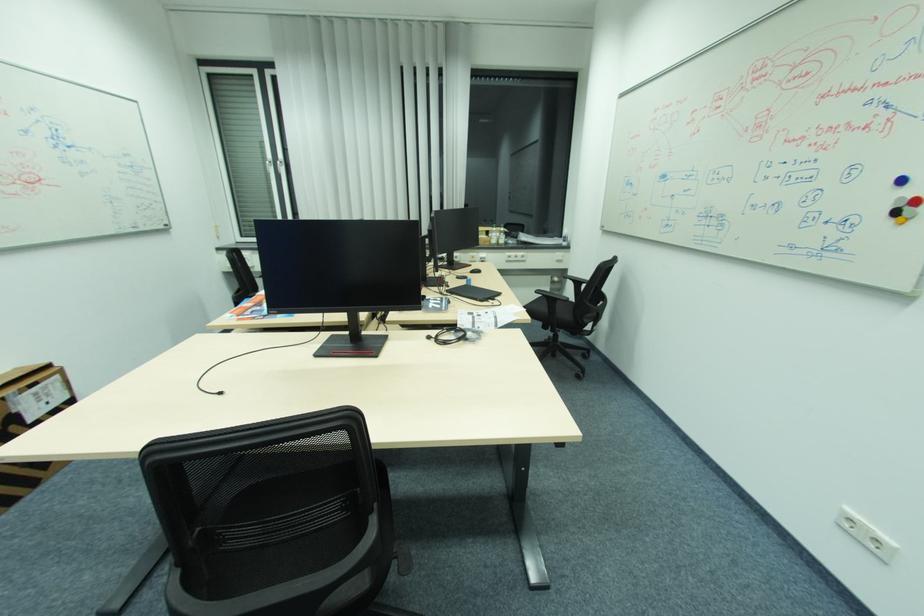
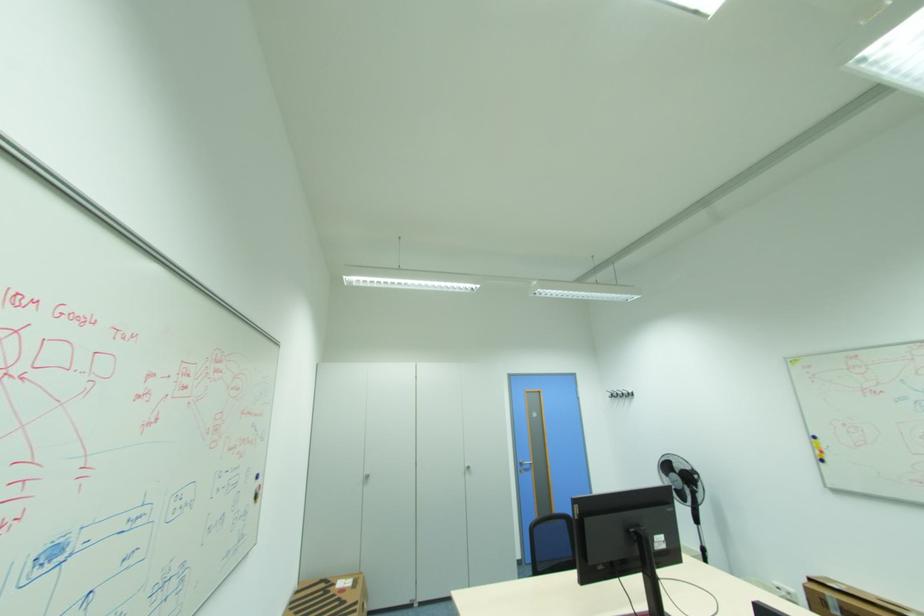
Question: I am providing you with two images of the same scene from different viewpoints. Which of the following objects are not visible in image2?

Choices:
 (A) black chair sitting surface
 (B) silver cooker lid
 (C) black wall hook
 (D) cardboard box

Answer: (A)